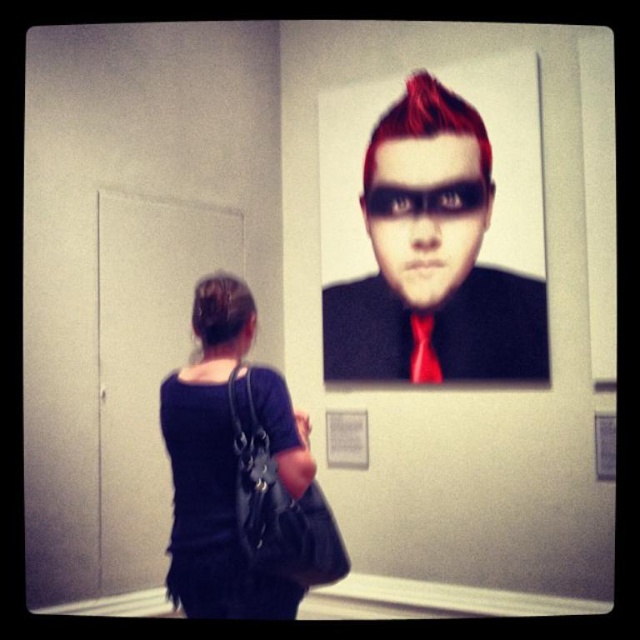
This screenshot has height=640, width=640. What do you see at coordinates (225, 460) in the screenshot? I see `dark blue fabric bag at lower left` at bounding box center [225, 460].

How much distance is there between dark blue fabric bag at lower left and red satin tie at upper center?

dark blue fabric bag at lower left and red satin tie at upper center are 36.26 inches apart from each other.

Locate an element on the screen. The width and height of the screenshot is (640, 640). dark blue fabric bag at lower left is located at coordinates (225, 460).

What do you see at coordinates (426, 212) in the screenshot?
I see `matte black mask at upper center` at bounding box center [426, 212].

Between matte black mask at upper center and black shiny hair at upper center, which one appears on the right side from the viewer's perspective?

matte black mask at upper center

The height and width of the screenshot is (640, 640). I want to click on matte black mask at upper center, so click(x=426, y=212).

What do you see at coordinates (225, 460) in the screenshot?
I see `dark blue fabric bag at lower left` at bounding box center [225, 460].

How distant is dark blue fabric bag at lower left from matte black mask at upper center?

dark blue fabric bag at lower left and matte black mask at upper center are 93.16 centimeters apart from each other.

Who is more distant from viewer, (x=209, y=289) or (x=492, y=198)?

The point (x=492, y=198) is more distant.

You are a GUI agent. You are given a task and a screenshot of the screen. Output one action in this format:
    pyautogui.click(x=<x>, y=<y>)
    Task: Click on the dark blue fabric bag at lower left
    
    Given the screenshot: What is the action you would take?
    pyautogui.click(x=225, y=460)